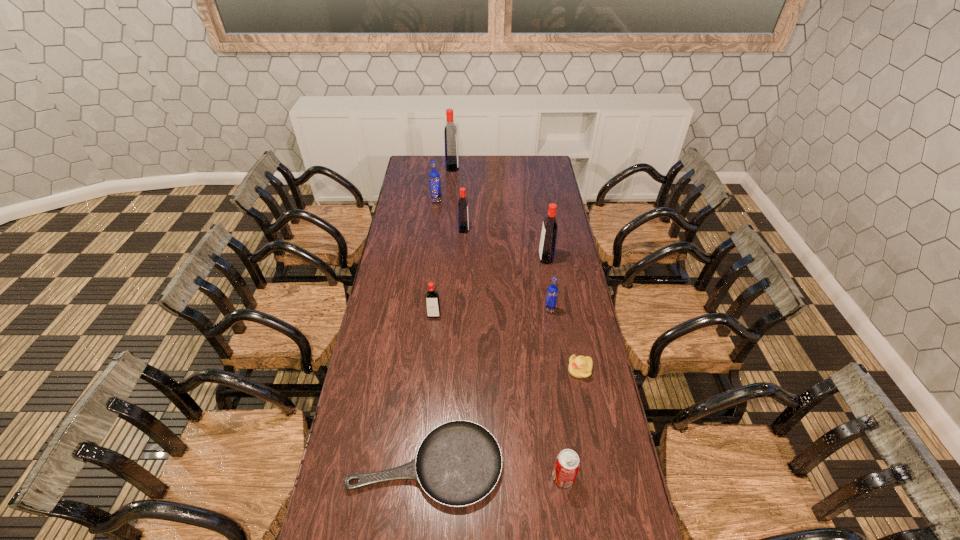
Select which red vodka appears as the third closest to the farthest object. Please provide its 2D coordinates. Your answer should be formatted as a tuple, i.e. [(x, y)], where the tuple contains the x and y coordinates of a point satisfying the conditions above.

[(433, 310)]

The width and height of the screenshot is (960, 540). What are the coordinates of `the third closest red vodka to the third red vodka from left to right` in the screenshot? It's located at coord(433,310).

I want to click on blank space that satisfies the following two spatial constraints: 1. on the front and back of the tallest object; 2. on the front and back of the smallest red vodka, so click(x=440, y=315).

You are a GUI agent. You are given a task and a screenshot of the screen. Output one action in this format:
    pyautogui.click(x=<x>, y=<y>)
    Task: Click on the vacant area that satisfies the following two spatial constraints: 1. on the front and back of the third farthest red vodka; 2. on the front and back of the nearest red vodka
    Image resolution: width=960 pixels, height=540 pixels.
    Given the screenshot: What is the action you would take?
    pyautogui.click(x=555, y=315)

Identify the location of free location that satisfies the following two spatial constraints: 1. on the back side of the smaller blue vodka; 2. on the front and back of the biggest red vodka. The height and width of the screenshot is (540, 960). (528, 168).